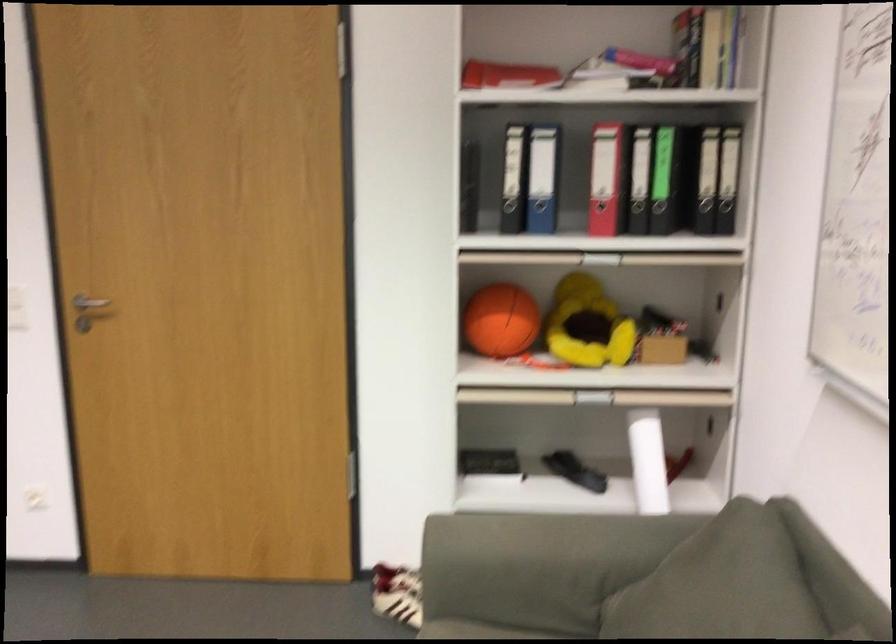
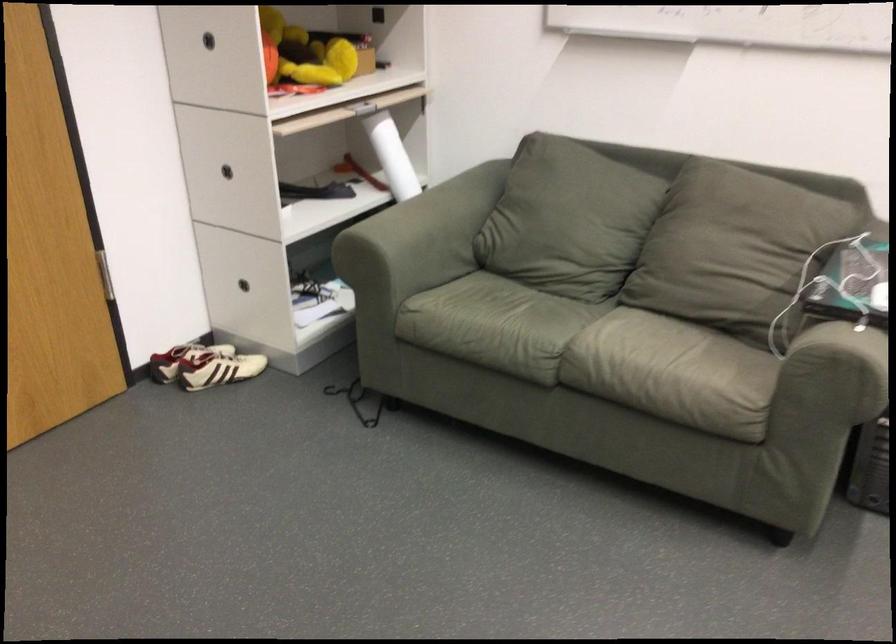
Find the pixel in the second image that matches the point at 486,564 in the first image.

(416, 242)